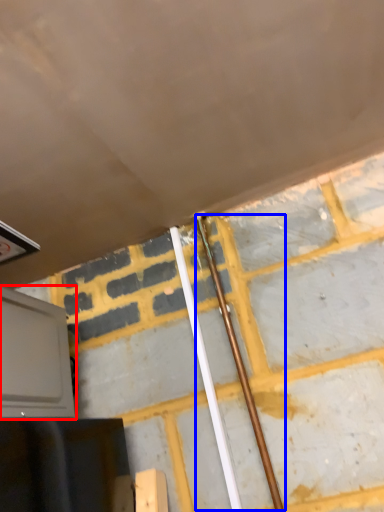
Question: Which of the following is the closest to the observer, oven (highlighted by a red box) or beam (highlighted by a blue box)?

Choices:
 (A) oven
 (B) beam

Answer: (A)